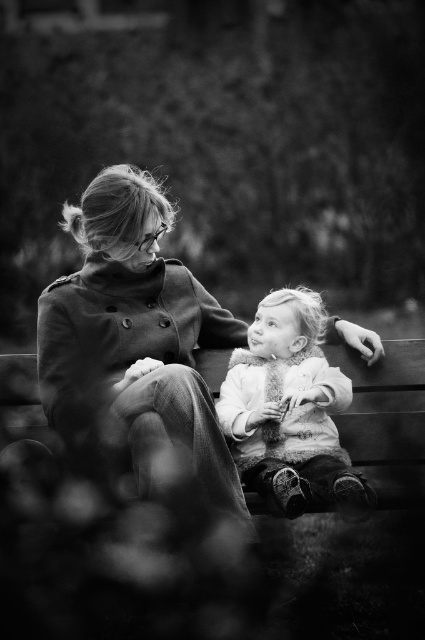
Does coated fabric coat at center appear on the right side of fuzzy white coat at center?

In fact, coated fabric coat at center is to the left of fuzzy white coat at center.

Who is shorter, coated fabric coat at center or fuzzy white coat at center?

Standing shorter between the two is fuzzy white coat at center.

Which is in front, point (206, 340) or point (308, 412)?

Point (308, 412) is in front.

Find the location of `coated fabric coat at center`. coated fabric coat at center is located at coordinates (136, 342).